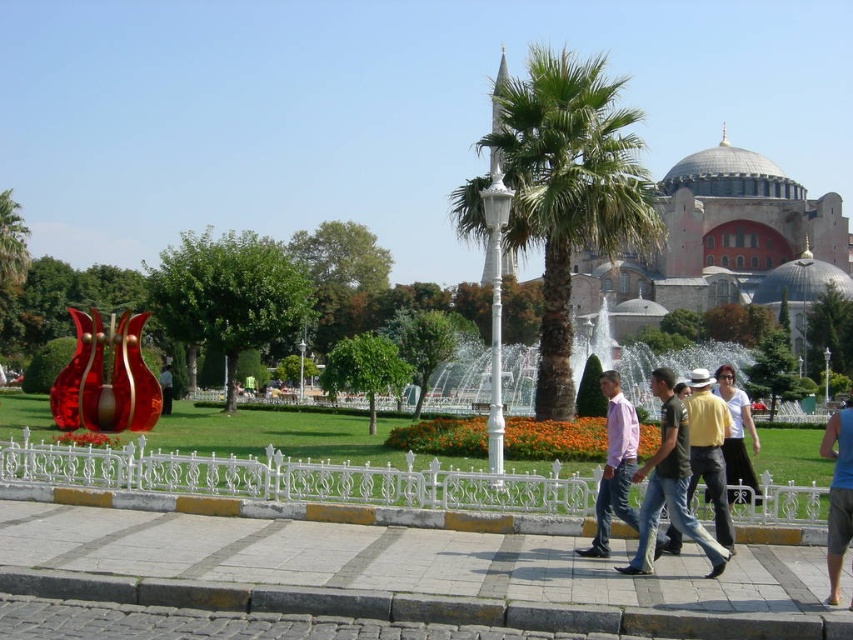
Question: Observing the image, what is the correct spatial positioning of cobblestone pavement at center in reference to blue fabric shorts at lower right?

Choices:
 (A) above
 (B) below

Answer: (B)

Question: Which of the following is the closest to the observer?

Choices:
 (A) light pink cotton shirt at center
 (B) pink cotton shirt at center

Answer: (A)

Question: Does green leafy palm tree at center appear over pink cotton shirt at center?

Choices:
 (A) yes
 (B) no

Answer: (A)

Question: Which point appears farthest from the camera in this image?

Choices:
 (A) (697, 408)
 (B) (166, 384)
 (C) (830, 522)

Answer: (B)

Question: Which object is the farthest from the metallic red sculpture at left?

Choices:
 (A) white cotton shirt at center
 (B) light pink cotton shirt at center

Answer: (A)

Question: In this image, where is pink cotton shirt at center located relative to white cotton shirt at center?

Choices:
 (A) below
 (B) above

Answer: (B)